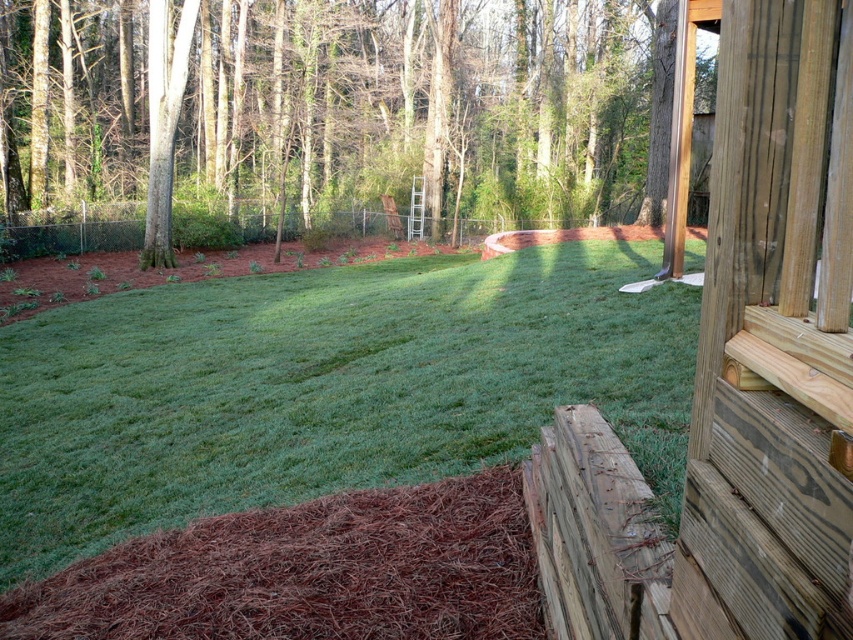
Question: Does brown wood tree at upper left have a smaller size compared to weathered wood at lower right?

Choices:
 (A) no
 (B) yes

Answer: (A)

Question: Where is brown wood tree at upper left located in relation to weathered wood at lower right in the image?

Choices:
 (A) right
 (B) left

Answer: (B)

Question: Is brown wood tree at upper left smaller than weathered wood at lower right?

Choices:
 (A) no
 (B) yes

Answer: (A)